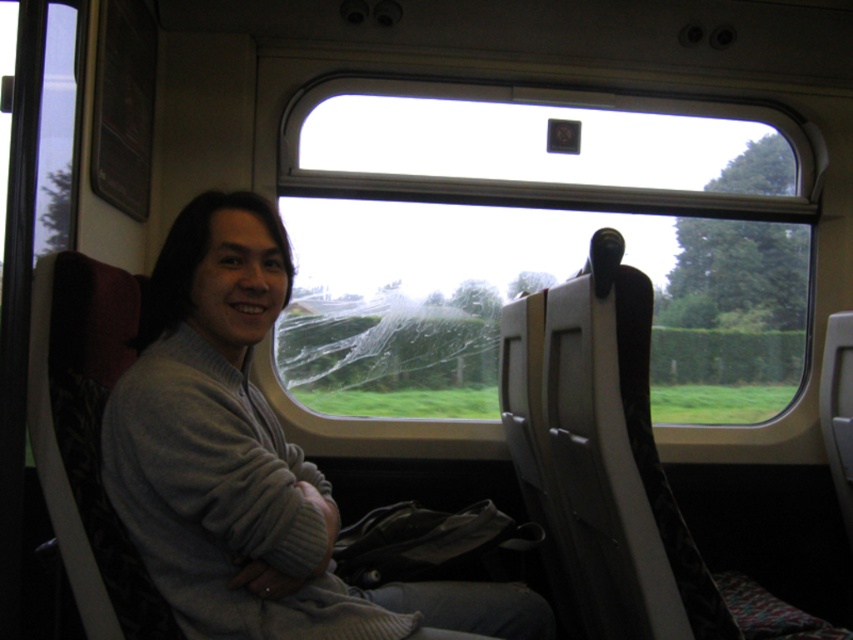
The height and width of the screenshot is (640, 853). Describe the element at coordinates (537, 241) in the screenshot. I see `transparent glass train window at center` at that location.

Looking at this image, who is shorter, transparent glass train window at center or gray knitwear at center?

With less height is gray knitwear at center.

Where is `transparent glass train window at center`? Image resolution: width=853 pixels, height=640 pixels. transparent glass train window at center is located at coordinates (537, 241).

The width and height of the screenshot is (853, 640). I want to click on transparent glass train window at center, so click(537, 241).